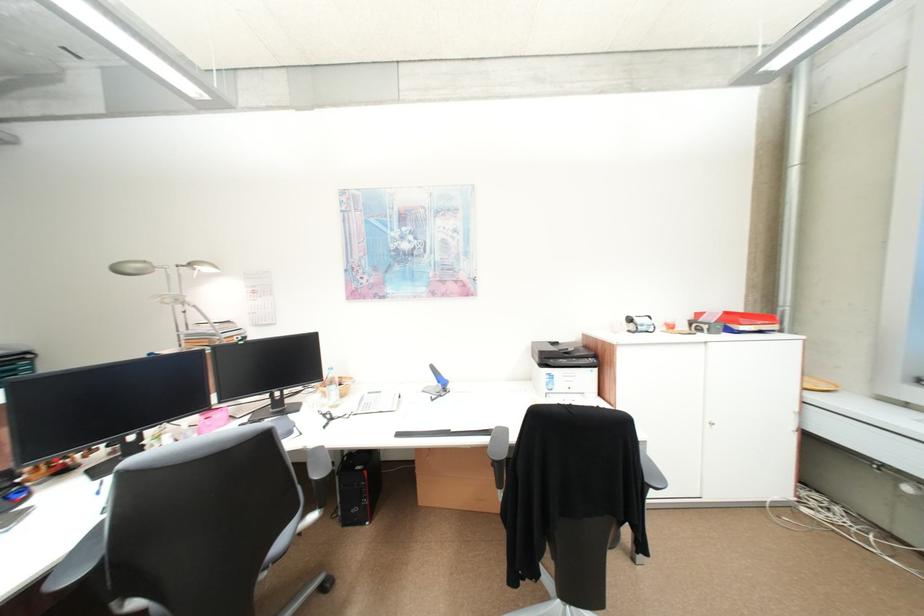
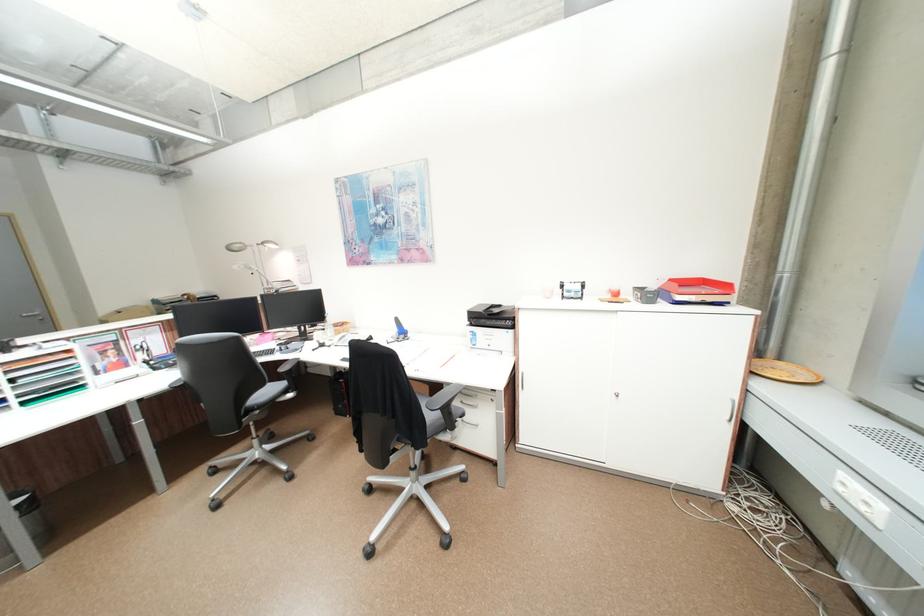
Where in the second image is the point corresponding to pixel 214 270 from the first image?

(281, 246)